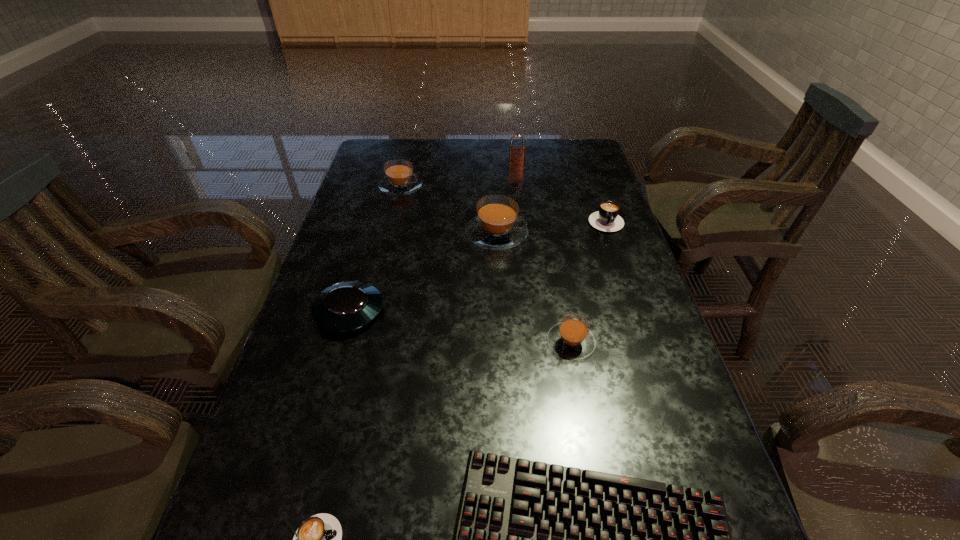
What are the coordinates of `saucer` in the screenshot? It's located at (349, 305).

Identify the location of vacant region located 0.050m on the front-facing side of the farthest object. (517, 172).

The width and height of the screenshot is (960, 540). Find the location of `free point located 0.200m on the back of the biggest brown cappuccino`. free point located 0.200m on the back of the biggest brown cappuccino is located at coordinates (494, 180).

You are a GUI agent. You are given a task and a screenshot of the screen. Output one action in this format:
    pyautogui.click(x=<x>, y=<y>)
    Task: Click on the free space located on the front of the third tallest object
    This screenshot has width=960, height=540.
    Given the screenshot: What is the action you would take?
    (396, 208)

You are a GUI agent. You are given a task and a screenshot of the screen. Output one action in this format:
    pyautogui.click(x=<x>, y=<y>)
    Task: Click on the vacant space situated 0.120m with the handle on the side of the rightmost cappuccino
    
    Given the screenshot: What is the action you would take?
    pyautogui.click(x=619, y=261)

Locate an element on the screen. vacant space located on the left of the smallest brown cappuccino is located at coordinates (375, 342).

Find the location of a particular element. free location located on the back of the saucer is located at coordinates (377, 214).

Locate an element on the screen. This screenshot has width=960, height=540. object present at the far edge is located at coordinates (516, 152).

At what (x,y) coordinates should I click in order to perform the action: click on cappuccino at the left edge. Please return your answer as a coordinate pair (x, y). Looking at the image, I should click on (400, 179).

This screenshot has height=540, width=960. What are the coordinates of `saucer that is at the left edge` in the screenshot? It's located at (349, 305).